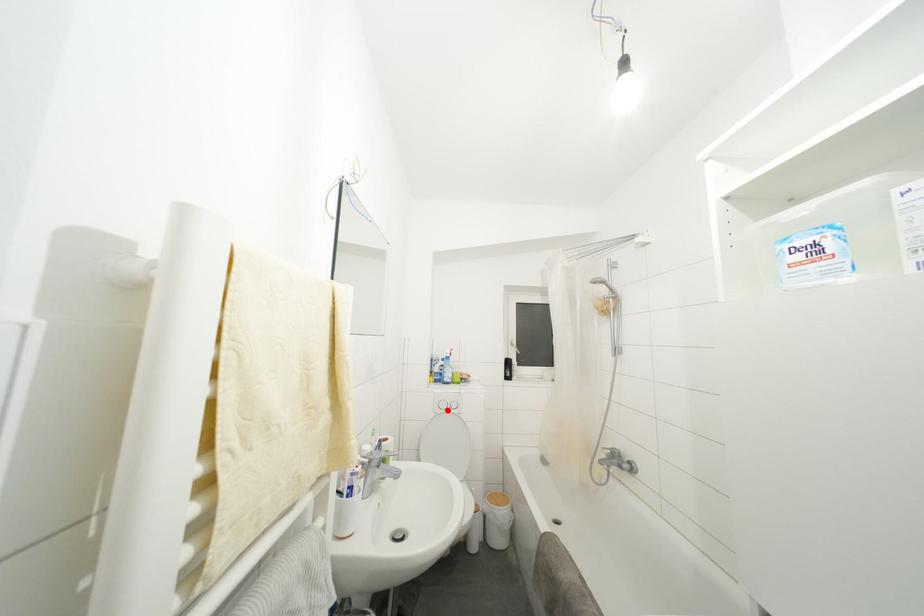
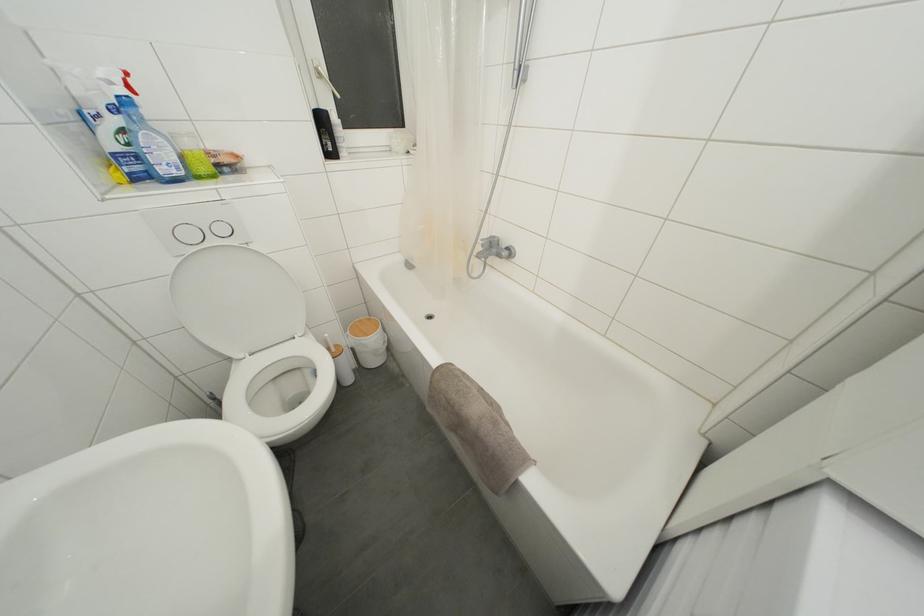
Question: I am providing you with two images of the same scene from different viewpoints. A red point is shown in image1. For the corresponding object point in image2, is it positioned nearer or farther from the camera?

Choices:
 (A) Nearer
 (B) Farther

Answer: (A)